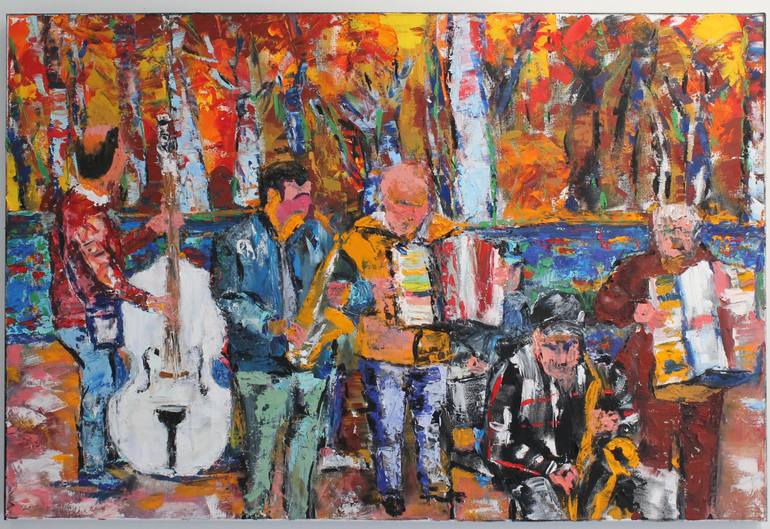
Find the location of a particular element. The height and width of the screenshot is (529, 770). painting is located at coordinates (357, 231).